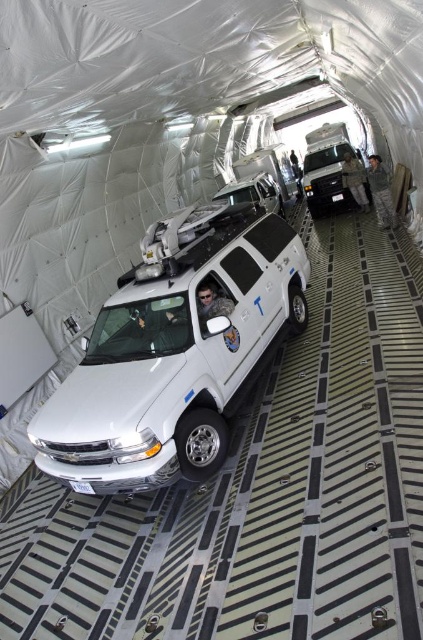
You are a military engineer inspecting the cargo hold of a transport plane. You notice two vehicles inside the cargo hold, the white glossy minivan at center and the white matte van at center. Which vehicle is positioned lower in the cargo hold?

The white glossy minivan at center is positioned lower in the cargo hold because it is below the white matte van at center.

You are a military logistics officer planning to load additional equipment into the cargo hold. You need to determine if there is enough space between the white glossy minivan at center and the white matte van at center to fit a standard 2m long crate. Can you confirm if the space between them is sufficient?

The white glossy minivan at center is shorter than the white matte van at center. However, the exact distance between them isn not provided in the description. Without knowing the actual space between the vehicles, it is impossible to determine if the 2m long crate will fit.

You are standing inside the aircraft cargo hold and want to reach the point marked at coordinates (x=98, y=337). Given that the cargo hold is 20 feet long, can you estimate whether this point is within the first half of the cargo hold from your current position?

The point marked at coordinates (x=98, y=337) is 15.01 feet away from the viewer. Since the cargo hold is 20 feet long, the first half would be up to 10 feet. Therefore, the point is beyond the first half of the cargo hold.